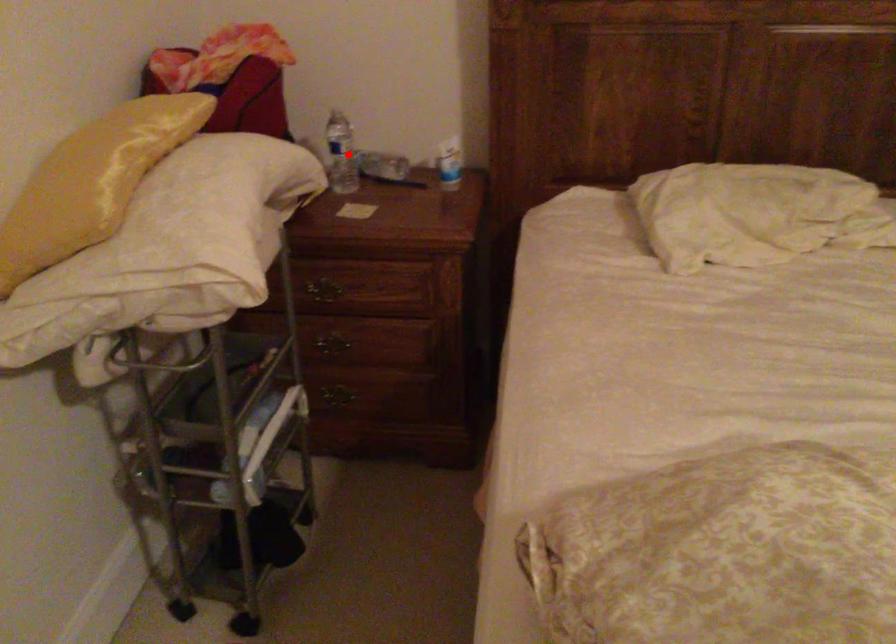
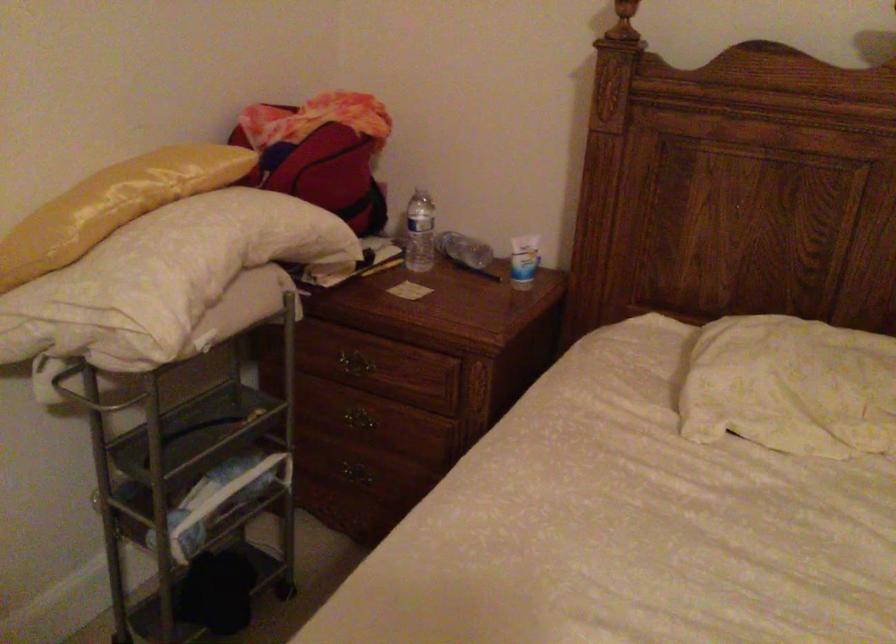
In the second image, find the point that corresponds to the highlighted location in the first image.

(419, 232)